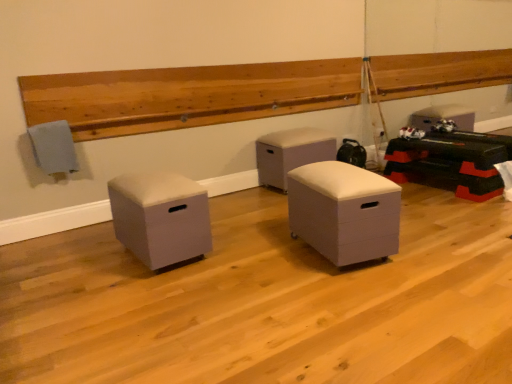
Question: Considering their positions, is white matte storage ottoman at center, which is counted as the third furniture, starting from the back, located in front of or behind white leather ottoman at center, acting as the 2th furniture starting from the left?

Choices:
 (A) behind
 (B) front

Answer: (B)

Question: Is white matte storage ottoman at center, which ranks as the 1th furniture in right-to-left order, to the left or to the right of white leather ottoman at center, the 2th furniture in the right-to-left sequence, in the image?

Choices:
 (A) right
 (B) left

Answer: (A)

Question: Estimate the real-world distances between objects in this image. Which object is closer to the matte gray ottoman at left, which is the 1th furniture from left to right?

Choices:
 (A) white matte storage ottoman at center, the first furniture viewed from the front
 (B) white leather ottoman at center, the 1th furniture in the back-to-front sequence

Answer: (A)

Question: Estimate the real-world distances between objects in this image. Which object is farther from the white matte storage ottoman at center, which is counted as the third furniture, starting from the left?

Choices:
 (A) white leather ottoman at center, the 1th furniture in the back-to-front sequence
 (B) matte gray ottoman at left, which is the 1th furniture from left to right

Answer: (A)